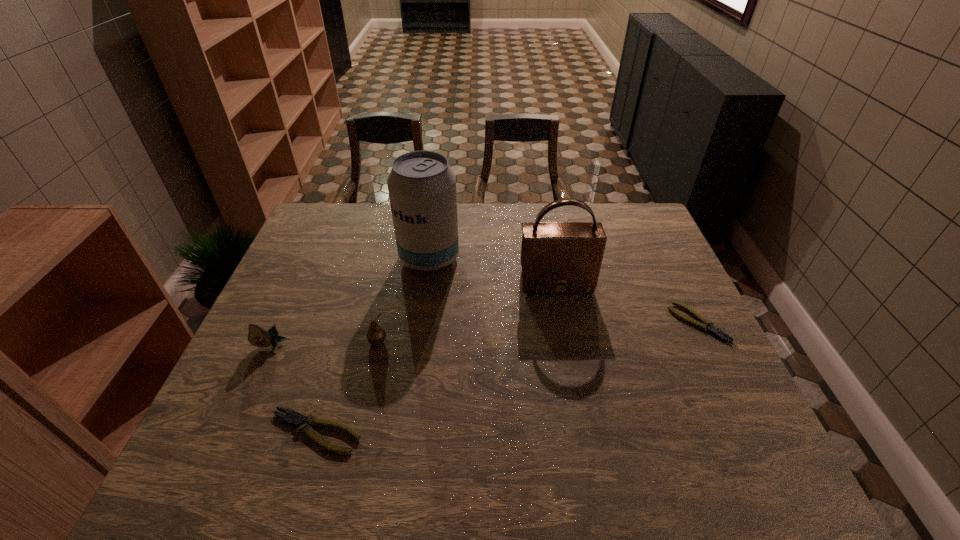
Locate an element on the screen. The height and width of the screenshot is (540, 960). unoccupied position between the avocado and the alcohol is located at coordinates (350, 302).

Where is `vacant region between the leftmost object and the pear`? This screenshot has width=960, height=540. vacant region between the leftmost object and the pear is located at coordinates (324, 344).

Where is `vacant space that is in between the avocado and the alcohol`? vacant space that is in between the avocado and the alcohol is located at coordinates (350, 302).

Find the location of a particular element. Image resolution: width=960 pixels, height=540 pixels. free spot between the shoulder bag and the leftmost object is located at coordinates (414, 315).

Where is `empty space that is in between the pear and the taller pliers`? This screenshot has height=540, width=960. empty space that is in between the pear and the taller pliers is located at coordinates (347, 387).

Where is `free spot between the nearest object and the pear`? This screenshot has width=960, height=540. free spot between the nearest object and the pear is located at coordinates (347, 387).

The height and width of the screenshot is (540, 960). What are the coordinates of `blank region between the alcohol and the pear` in the screenshot? It's located at (403, 300).

Identify the location of object that stands as the closest to the leftmost object. This screenshot has width=960, height=540. (296, 419).

Where is `the fifth closest object relative to the alcohol`? This screenshot has height=540, width=960. the fifth closest object relative to the alcohol is located at coordinates (704, 324).

Locate an element on the screen. free region that satisfies the following two spatial constraints: 1. on the back side of the nearer pliers; 2. on the right side of the alcohol is located at coordinates (367, 258).